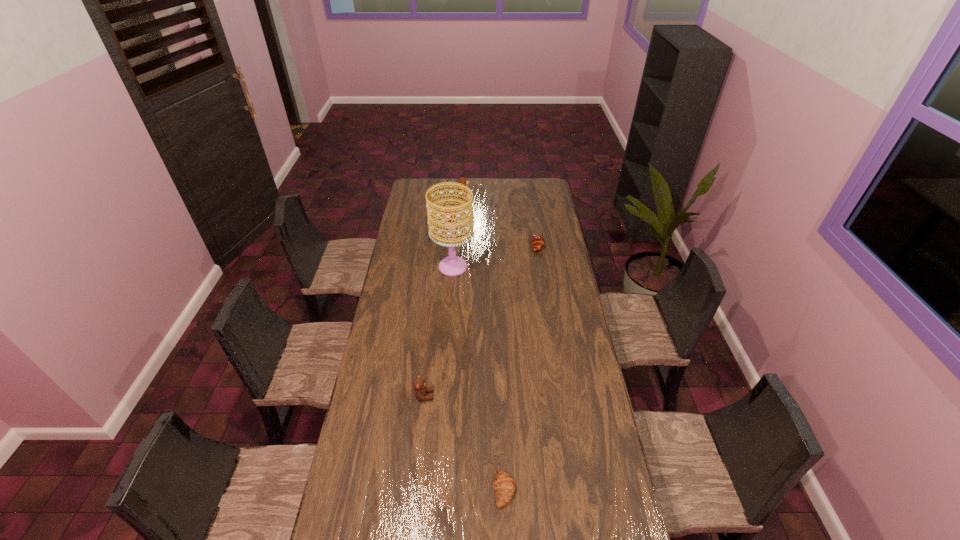
Locate an element on the screen. This screenshot has width=960, height=540. vacant space that satisfies the following two spatial constraints: 1. on the front side of the lampshade; 2. on the right side of the second object from right to left is located at coordinates (438, 490).

Image resolution: width=960 pixels, height=540 pixels. Find the location of `free space that satisfies the following two spatial constraints: 1. on the face of the farther teddy bear; 2. on the right side of the left crescent roll`. free space that satisfies the following two spatial constraints: 1. on the face of the farther teddy bear; 2. on the right side of the left crescent roll is located at coordinates [x=449, y=490].

This screenshot has height=540, width=960. In order to click on free point that satisfies the following two spatial constraints: 1. on the front side of the lampshade; 2. on the left side of the left crescent roll in this screenshot , I will do `click(438, 490)`.

Where is `vacant region that satisfies the following two spatial constraints: 1. on the face of the second object from right to left; 2. on the right side of the nearer teddy bear`? vacant region that satisfies the following two spatial constraints: 1. on the face of the second object from right to left; 2. on the right side of the nearer teddy bear is located at coordinates (414, 490).

Find the location of a particular element. free space that satisfies the following two spatial constraints: 1. on the face of the nearer teddy bear; 2. on the back side of the nearest object is located at coordinates (414, 490).

Where is `vacant position in the image that satisfies the following two spatial constraints: 1. on the face of the left teddy bear; 2. on the right side of the nearer crescent roll`? Image resolution: width=960 pixels, height=540 pixels. vacant position in the image that satisfies the following two spatial constraints: 1. on the face of the left teddy bear; 2. on the right side of the nearer crescent roll is located at coordinates (414, 490).

Find the location of a particular element. Image resolution: width=960 pixels, height=540 pixels. free space in the image that satisfies the following two spatial constraints: 1. on the face of the nearer crescent roll; 2. on the right side of the right teddy bear is located at coordinates (449, 490).